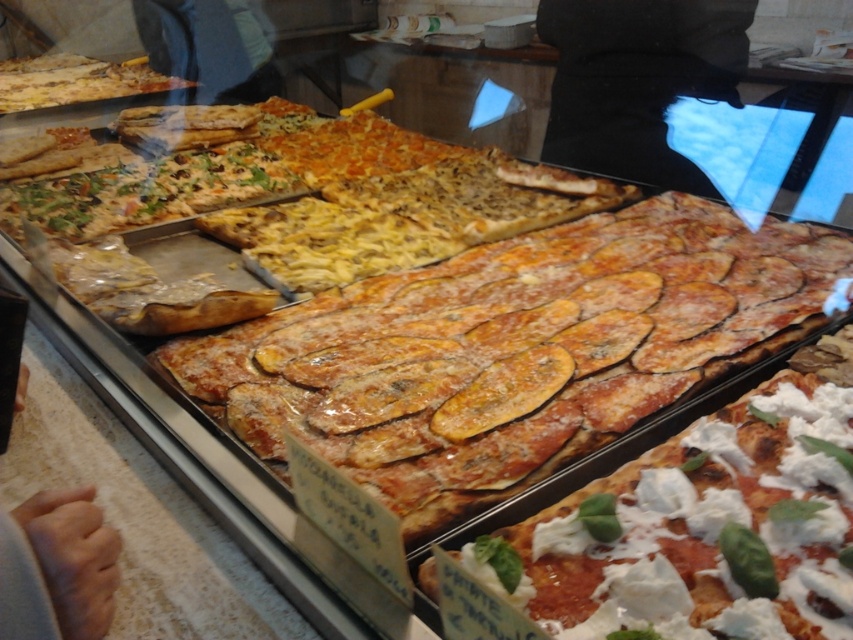
You are a customer standing in front of the pizza display case. You want to know if the distance between the white creamy cheese at center and the golden brown crust at upper left is more than 3 meters. Can you determine this based on the information provided?

The white creamy cheese at center is 3.64 meters from the golden brown crust at upper left, so yes, the distance between them is more than 3 meters.

You are a customer looking at the display case of pizzas. You notice the white creamy cheese at center and the golden brown crust at upper left. Which of these two items is closer to the top of the display case?

The golden brown crust at upper left is closer to the top of the display case because it is taller than the white creamy cheese at center.